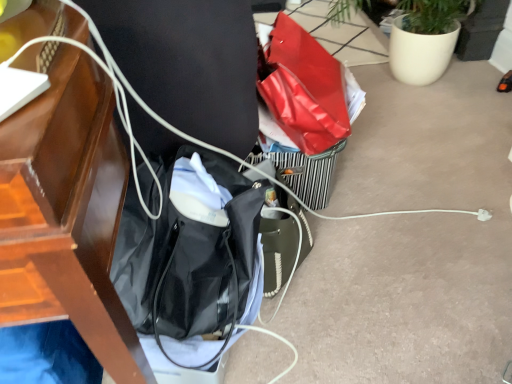
What do you see at coordinates (425, 39) in the screenshot? I see `green leafy plant at upper right` at bounding box center [425, 39].

Locate an element on the screen. Image resolution: width=512 pixels, height=384 pixels. green leafy plant at upper right is located at coordinates (425, 39).

Locate an element on the screen. green leafy plant at upper right is located at coordinates (425, 39).